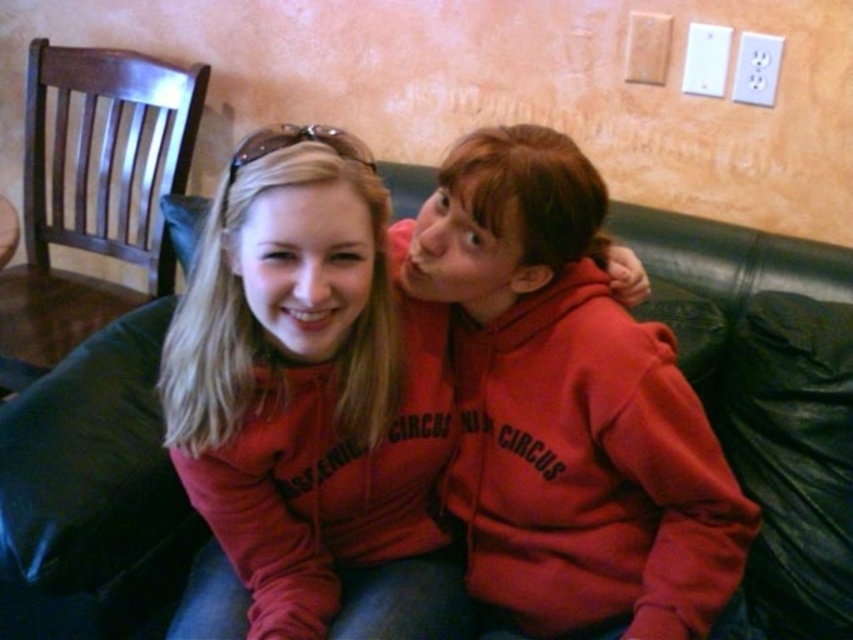
Question: Is matte red hoodie at center to the right of matte red sweatshirt at center from the viewer's perspective?

Choices:
 (A) yes
 (B) no

Answer: (A)

Question: Can you confirm if black leather couch at center is positioned above matte red hoodie at center?

Choices:
 (A) yes
 (B) no

Answer: (A)

Question: Does black leather couch at center appear on the right side of matte red hoodie at center?

Choices:
 (A) yes
 (B) no

Answer: (A)

Question: Among these points, which one is nearest to the camera?

Choices:
 (A) (154, 605)
 (B) (706, 476)
 (C) (312, 467)

Answer: (B)

Question: Which point is farther from the camera taking this photo?

Choices:
 (A) (612, 218)
 (B) (691, 392)
 (C) (279, 384)

Answer: (A)

Question: Which object is positioned farthest from the matte red hoodie at center?

Choices:
 (A) black leather couch at center
 (B) matte red sweatshirt at center

Answer: (A)